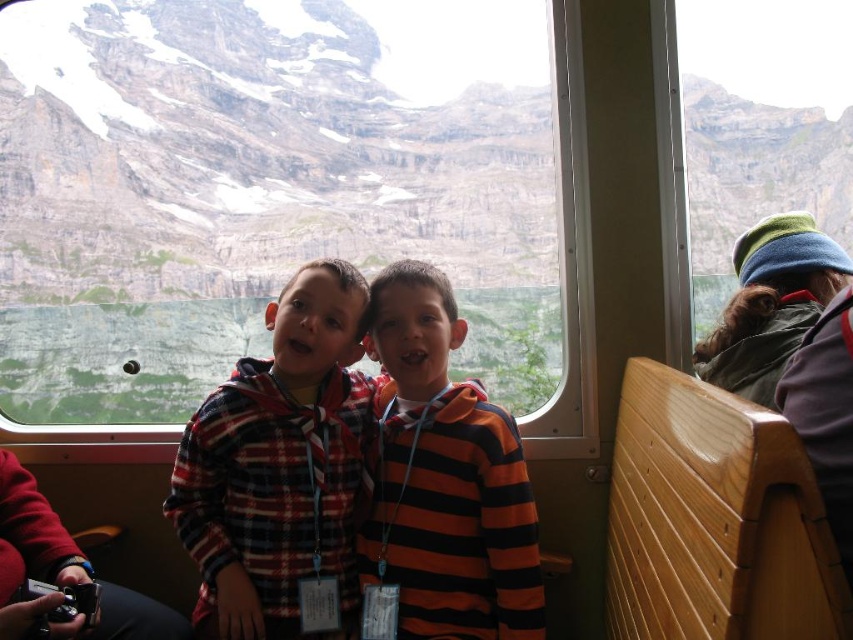
Identify the location of plaid fabric shirt at center. (277, 465).

Between plaid fabric shirt at center and orange striped hoodie at center, which one is positioned higher?

Positioned higher is plaid fabric shirt at center.

Which is behind, point (303, 397) or point (398, 483)?

The point (303, 397) is more distant.

At what (x,y) coordinates should I click in order to perform the action: click on plaid fabric shirt at center. Please return your answer as a coordinate pair (x, y). Image resolution: width=853 pixels, height=640 pixels. Looking at the image, I should click on (277, 465).